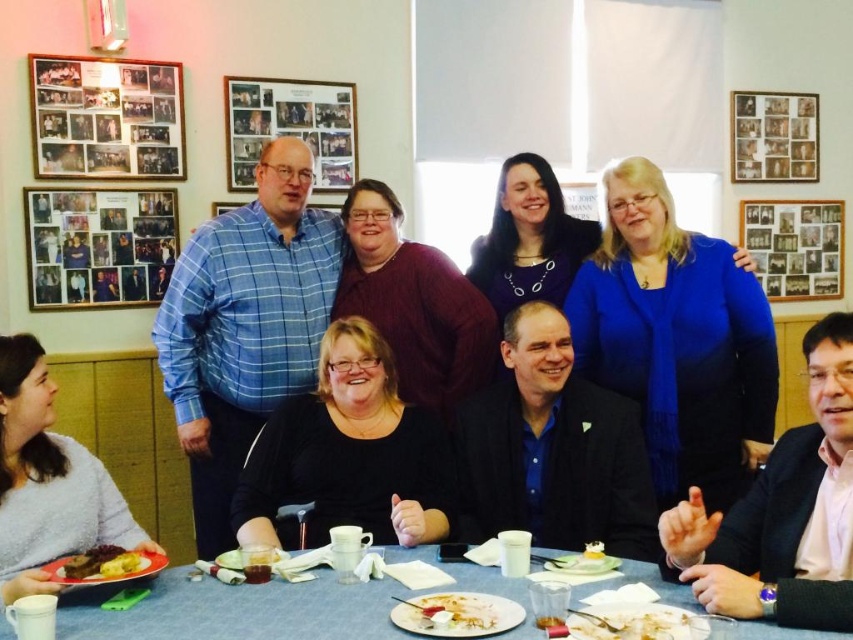
Is point (286, 582) closer to viewer compared to point (131, 564)?

No.

Which is more to the right, blue fabric table at lower center or golden brown bread at lower left?

blue fabric table at lower center

Locate an element on the screen. The width and height of the screenshot is (853, 640). blue fabric table at lower center is located at coordinates (270, 609).

Which is above, pink satin shirt at lower right or white creamy food at lower center?

pink satin shirt at lower right

Is pink satin shirt at lower right below white creamy food at lower center?

No, pink satin shirt at lower right is not below white creamy food at lower center.

Identify the location of pink satin shirt at lower right. The image size is (853, 640). (782, 513).

Does fluffy white sweater at lower left appear on the left side of white porcelain plate at lower center?

Yes, fluffy white sweater at lower left is to the left of white porcelain plate at lower center.

Identify the location of fluffy white sweater at lower left. Image resolution: width=853 pixels, height=640 pixels. (48, 481).